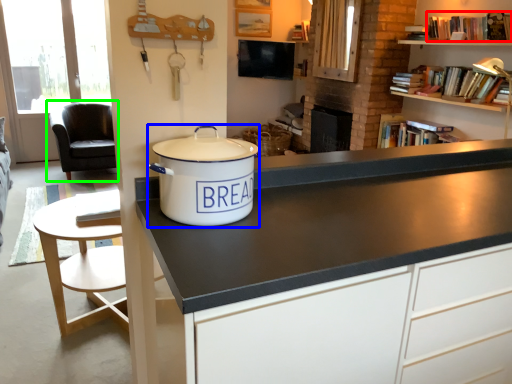
Question: Which is nearer to the book (highlighted by a red box)? cooker (highlighted by a blue box) or chair (highlighted by a green box).

Choices:
 (A) cooker
 (B) chair

Answer: (A)